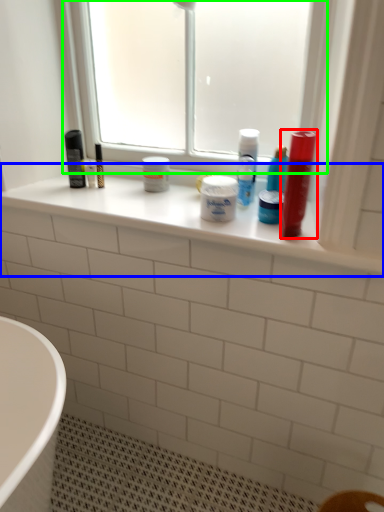
Question: Which is farther away from mouthwash (highlighted by a red box)? window sill (highlighted by a blue box) or window (highlighted by a green box)?

Choices:
 (A) window sill
 (B) window

Answer: (B)